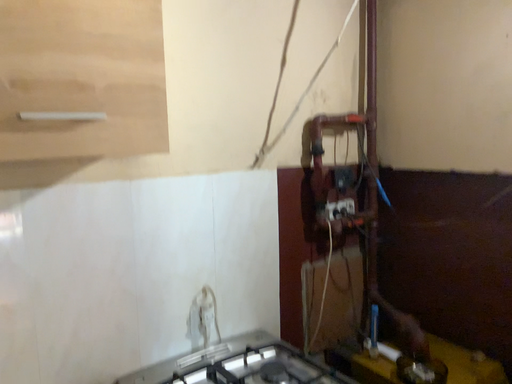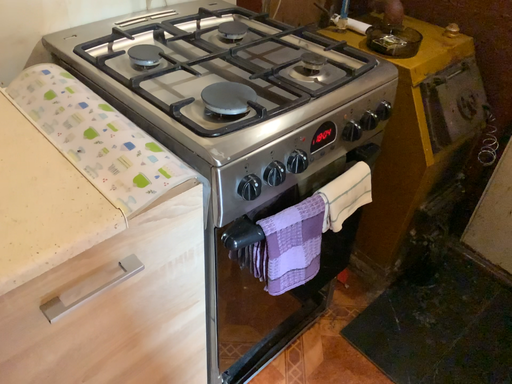
Question: Which way did the camera rotate in the video?

Choices:
 (A) rotated upward
 (B) rotated downward

Answer: (B)